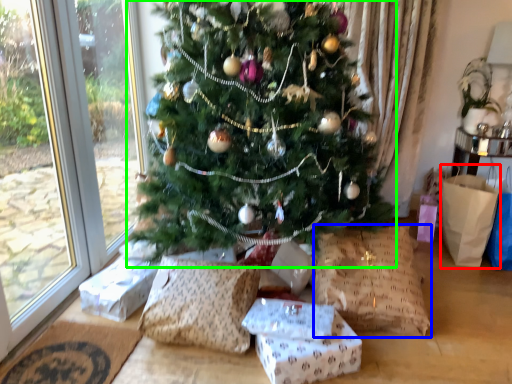
Question: Which object is the farthest from shopping bag (highlighted by a red box)? Choose among these: pillow (highlighted by a blue box) or christmas tree (highlighted by a green box).

Choices:
 (A) pillow
 (B) christmas tree

Answer: (B)